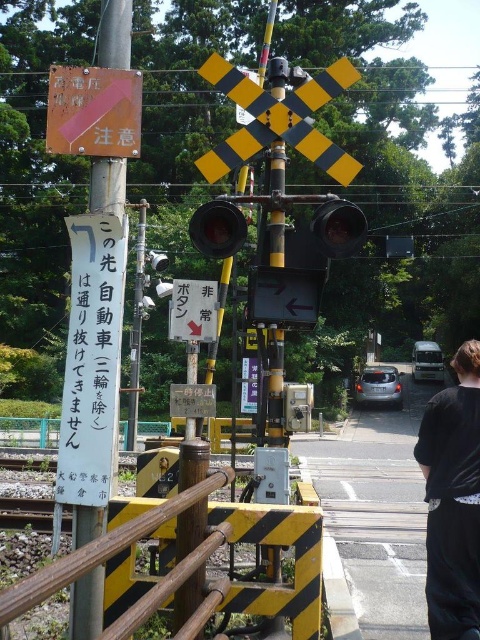
From the picture: You are a maintenance worker at the railway crossing and need to press the button to test the system. Which object, the metallic gray button at center or the metallic bell at center, is wider so you can easily press it with your hand?

The metallic gray button at center is wider than the metallic bell at center, so you can easily press it with your hand.

You are a delivery person holding a black fabric bag at lower right and need to place it on a shelf next to the matte black traffic light at center. Which object is wider so that it occupies more space horizontally?

The black fabric bag at lower right might be wider than matte black traffic light at center, so it occupies more horizontal space.

You are a pedestrian standing at the railway crossing and see the black fabric bag at lower right and the matte black traffic light at center. Which object is positioned more to the right side of the crossing?

The black fabric bag at lower right is positioned more to the right side of the crossing than the matte black traffic light at center.